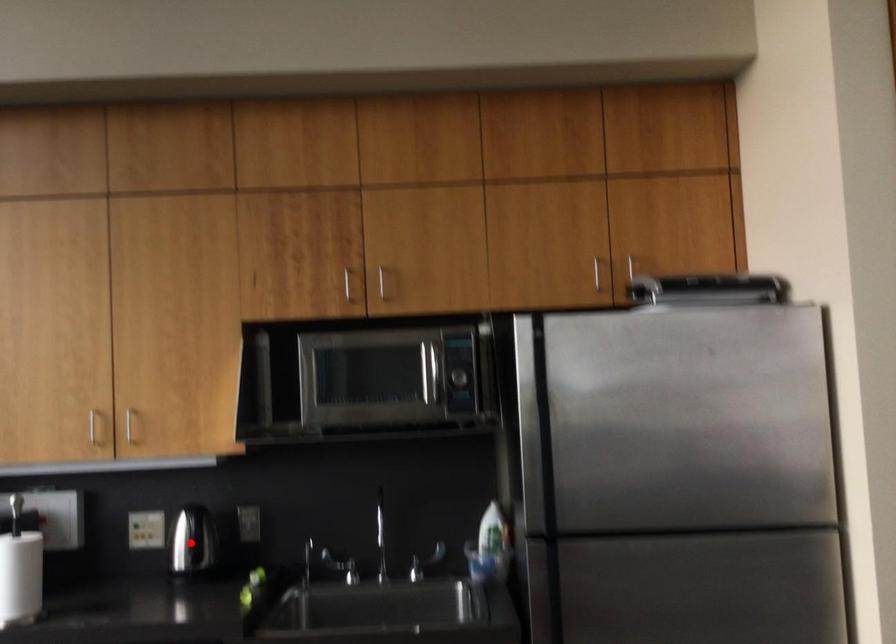
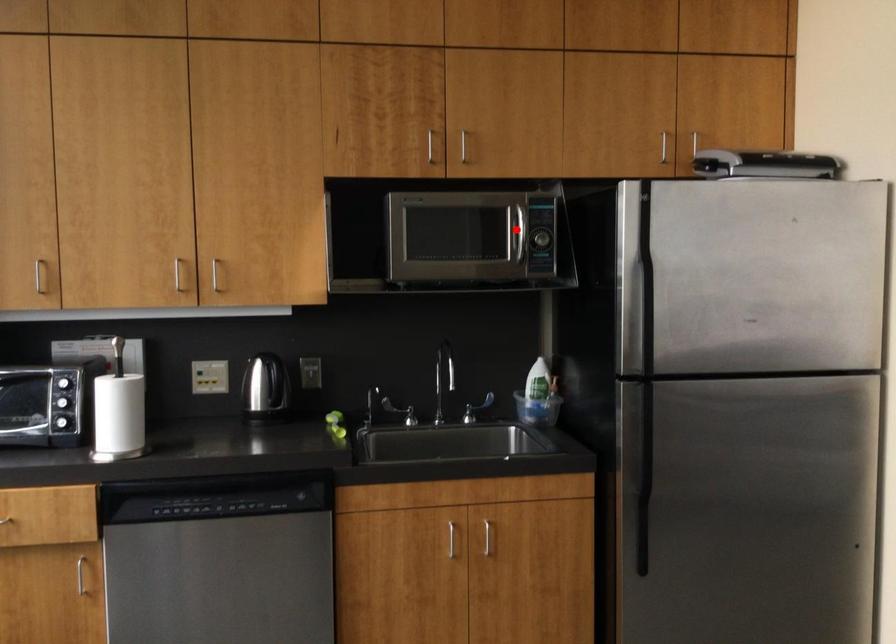
I am providing you with two images of the same scene from different viewpoints. A red point is marked on the first image and another point is marked on the second image. Does the point marked in image1 correspond to the same location as the one in image2?

No